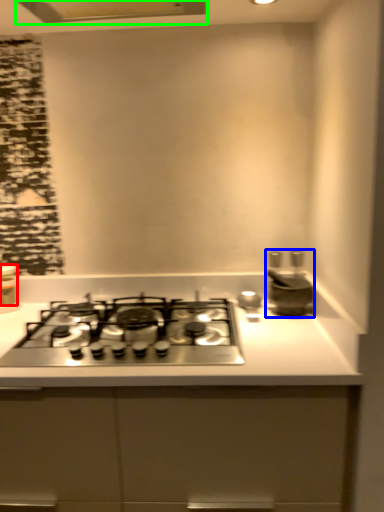
Question: Which is nearer to the kitchen appliance (highlighted by a red box)? appliance (highlighted by a blue box) or exhaust hood (highlighted by a green box).

Choices:
 (A) appliance
 (B) exhaust hood

Answer: (B)